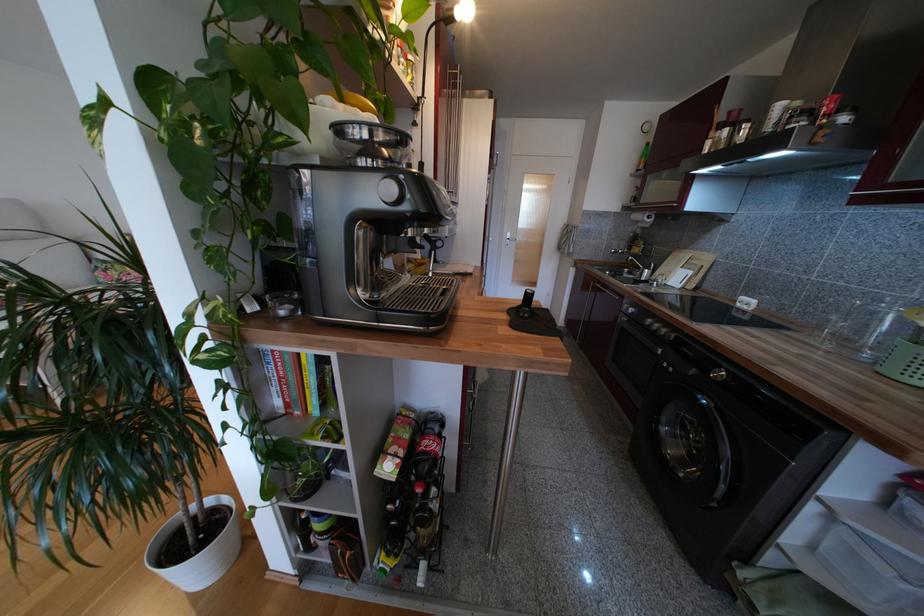
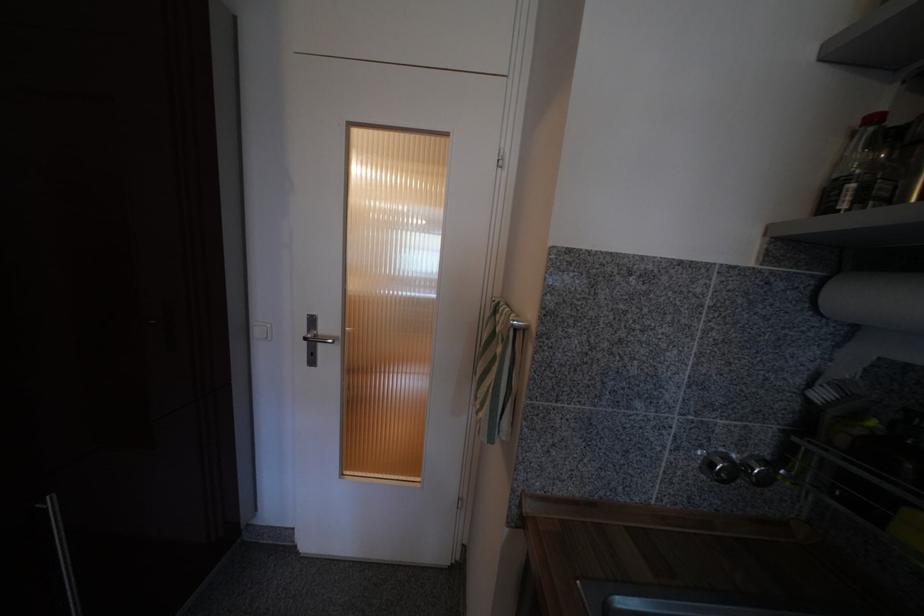
What movement of the cameraman would produce the second image?

The cameraman moved toward right, forward.